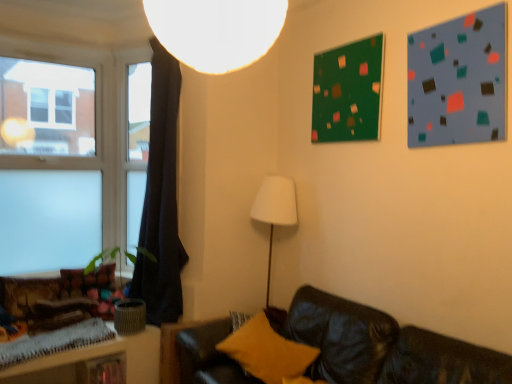
What is the approximate height of white matte lampshade at upper center?

white matte lampshade at upper center is 11.65 inches tall.

What do you see at coordinates (69, 156) in the screenshot? The image size is (512, 384). I see `transparent glass window at left` at bounding box center [69, 156].

Locate an element on the screen. transparent glass window at left is located at coordinates (x=69, y=156).

Where is `yellow fuzzy pillow at lower center, the second pillow from the left`? This screenshot has height=384, width=512. yellow fuzzy pillow at lower center, the second pillow from the left is located at coordinates (268, 352).

This screenshot has width=512, height=384. I want to click on green matte bulletin board at upper center, which is the second bulletin board from front to back, so click(x=347, y=92).

What do you see at coordinates (87, 279) in the screenshot? I see `velvet textured pillow at lower left, positioned as the second pillow in right-to-left order` at bounding box center [87, 279].

You are a GUI agent. You are given a task and a screenshot of the screen. Output one action in this format:
    pyautogui.click(x=<x>, y=<y>)
    Task: Click on the dark fabric curtain at left
    The height and width of the screenshot is (384, 512).
    Given the screenshot: What is the action you would take?
    pyautogui.click(x=161, y=199)

In the image, is dark fabric curtain at left positioned in front of or behind wooden textured table at lower left?

dark fabric curtain at left is behind wooden textured table at lower left.

Consider the image. What's the angular difference between dark fabric curtain at left and wooden textured table at lower left's facing directions?

The angle between the facing direction of dark fabric curtain at left and the facing direction of wooden textured table at lower left is 64.6 degrees.

Is dark fabric curtain at left positioned beyond the bounds of wooden textured table at lower left?

dark fabric curtain at left is positioned outside wooden textured table at lower left.

Is point (145, 277) less distant than point (65, 382)?

No, (145, 277) is further to viewer.

Looking at their sizes, would you say yellow fuzzy pillow at lower center, positioned as the second pillow in back-to-front order, is wider or thinner than dark fabric curtain at left?

Clearly, yellow fuzzy pillow at lower center, positioned as the second pillow in back-to-front order, has more width compared to dark fabric curtain at left.

Between point (264, 353) and point (176, 293), which one is positioned in front?

Positioned in front is point (264, 353).

Is yellow fuzzy pillow at lower center, marked as the 1th pillow in a right-to-left arrangement, oriented away from dark fabric curtain at left?

yellow fuzzy pillow at lower center, marked as the 1th pillow in a right-to-left arrangement, does not have its back to dark fabric curtain at left.

This screenshot has height=384, width=512. Identify the location of curtain that appears on the left of green matte bulletin board at upper center, which is the second bulletin board from front to back. (161, 199).

From a real-world perspective, does dark fabric curtain at left sit lower than green matte bulletin board at upper center, acting as the 1th bulletin board starting from the left?

Indeed, from a real-world perspective, dark fabric curtain at left is positioned beneath green matte bulletin board at upper center, acting as the 1th bulletin board starting from the left.

Based on the photo, is dark fabric curtain at left spatially inside green matte bulletin board at upper center, the 2th bulletin board when ordered from right to left, or outside of it?

dark fabric curtain at left is not inside green matte bulletin board at upper center, the 2th bulletin board when ordered from right to left, it's outside.

From the image's perspective, which is below, dark fabric curtain at left or green matte bulletin board at upper center, the 2th bulletin board when ordered from right to left?

dark fabric curtain at left appears lower in the image.

From the image's perspective, is green matte bulletin board at upper center, the 2th bulletin board when ordered from right to left, on dark fabric curtain at left?

Yes, from the image's perspective, green matte bulletin board at upper center, the 2th bulletin board when ordered from right to left, is over dark fabric curtain at left.

Which of these two, green matte bulletin board at upper center, acting as the 1th bulletin board starting from the left, or dark fabric curtain at left, is bigger?

Result: With larger size is dark fabric curtain at left.

Is green matte bulletin board at upper center, which appears as the 1th bulletin board when viewed from the back, facing towards dark fabric curtain at left?

A: No, green matte bulletin board at upper center, which appears as the 1th bulletin board when viewed from the back, is not turned towards dark fabric curtain at left.

Would you say green matte bulletin board at upper center, the 2th bulletin board when ordered from right to left, is outside dark fabric curtain at left?

Yes, green matte bulletin board at upper center, the 2th bulletin board when ordered from right to left, is not within dark fabric curtain at left.

Choose the correct answer: Is green matte bulletin board at upper center, which appears as the 1th bulletin board when viewed from the back, inside velvet textured pillow at lower left, the 2th pillow viewed from the front, or outside it?

green matte bulletin board at upper center, which appears as the 1th bulletin board when viewed from the back, lies outside velvet textured pillow at lower left, the 2th pillow viewed from the front.

Can you confirm if green matte bulletin board at upper center, which is the second bulletin board from front to back, is shorter than velvet textured pillow at lower left, positioned as the second pillow in right-to-left order?

No.

Is green matte bulletin board at upper center, the 2th bulletin board when ordered from right to left, touching velvet textured pillow at lower left, acting as the first pillow starting from the left?

They are not placed beside each other.

Considering the relative sizes of dark fabric curtain at left and velvet textured pillow at lower left, positioned as the second pillow in right-to-left order, in the image provided, is dark fabric curtain at left smaller than velvet textured pillow at lower left, positioned as the second pillow in right-to-left order,?

No.

Is velvet textured pillow at lower left, the 2th pillow viewed from the front, completely or partially inside dark fabric curtain at left?

No.

Between dark fabric curtain at left and velvet textured pillow at lower left, positioned as the second pillow in right-to-left order, which one is positioned in front?

Positioned in front is dark fabric curtain at left.

Which of these two, dark fabric curtain at left or velvet textured pillow at lower left, which is the 1th pillow in back-to-front order, stands taller?

With more height is dark fabric curtain at left.

Based on the photo, would you say transparent glass window at left is part of white matte lampshade at upper center's contents?

No, white matte lampshade at upper center does not contain transparent glass window at left.

Considering the relative sizes of white matte lampshade at upper center and transparent glass window at left in the image provided, is white matte lampshade at upper center bigger than transparent glass window at left?

No.

Is white matte lampshade at upper center thinner than transparent glass window at left?

In fact, white matte lampshade at upper center might be wider than transparent glass window at left.

From a real-world perspective, is white matte lampshade at upper center beneath transparent glass window at left?

No.

Where is `curtain lying on the right of wooden textured table at lower left`? This screenshot has height=384, width=512. curtain lying on the right of wooden textured table at lower left is located at coordinates (161, 199).

Identify the location of the 2nd pillow positioned below the dark fabric curtain at left (from the image's perspective). (268, 352).

Considering their positions, is matte blue bulletin board at upper right, positioned as the first bulletin board in front-to-back order, positioned further to dark fabric curtain at left than green matte bulletin board at upper center, the 2th bulletin board when ordered from right to left?

matte blue bulletin board at upper right, positioned as the first bulletin board in front-to-back order, is further to dark fabric curtain at left.

Which object lies further to the anchor point wooden textured table at lower left, white matte lampshade at upper center or transparent glass window at left?

white matte lampshade at upper center.

Looking at the image, which one is located closer to dark fabric curtain at left, yellow fuzzy pillow at lower center, positioned as the first pillow in front-to-back order, or velvet textured pillow at lower left, positioned as the second pillow in right-to-left order?

Based on the image, velvet textured pillow at lower left, positioned as the second pillow in right-to-left order, appears to be nearer to dark fabric curtain at left.

Which object lies further to the anchor point transparent glass window at left, white matte lampshade at upper center or velvet textured pillow at lower left, positioned as the second pillow in right-to-left order?

white matte lampshade at upper center is further to transparent glass window at left.

Which object lies nearer to the anchor point matte blue bulletin board at upper right, the second bulletin board in the back-to-front sequence, transparent glass window at left or green matte bulletin board at upper center, which is the second bulletin board from front to back?

green matte bulletin board at upper center, which is the second bulletin board from front to back, is positioned closer to the anchor matte blue bulletin board at upper right, the second bulletin board in the back-to-front sequence.

When comparing their distances from transparent glass window at left, does dark fabric curtain at left or white matte lampshade at upper center seem further?

Based on the image, white matte lampshade at upper center appears to be further to transparent glass window at left.

Consider the image. Which object lies nearer to the anchor point wooden textured table at lower left, dark fabric curtain at left or yellow fuzzy pillow at lower center, the second pillow from the left?

Among the two, dark fabric curtain at left is located nearer to wooden textured table at lower left.

Estimate the real-world distances between objects in this image. Which object is further from velvet textured pillow at lower left, acting as the first pillow starting from the left, wooden textured table at lower left or dark fabric curtain at left?

dark fabric curtain at left.

The width and height of the screenshot is (512, 384). I want to click on curtain between green matte bulletin board at upper center, which appears as the 1th bulletin board when viewed from the back, and yellow fuzzy pillow at lower center, positioned as the first pillow in front-to-back order, vertically, so pyautogui.click(x=161, y=199).

Image resolution: width=512 pixels, height=384 pixels. Find the location of `pillow located between transparent glass window at left and yellow fuzzy pillow at lower center, positioned as the second pillow in back-to-front order, in the left-right direction`. pillow located between transparent glass window at left and yellow fuzzy pillow at lower center, positioned as the second pillow in back-to-front order, in the left-right direction is located at coordinates (87, 279).

Find the location of `pillow between velvet textured pillow at lower left, positioned as the second pillow in right-to-left order, and green matte bulletin board at upper center, which is the second bulletin board from front to back, in the horizontal direction`. pillow between velvet textured pillow at lower left, positioned as the second pillow in right-to-left order, and green matte bulletin board at upper center, which is the second bulletin board from front to back, in the horizontal direction is located at coordinates (268, 352).

This screenshot has height=384, width=512. In order to click on lamp that lies between green matte bulletin board at upper center, the 2th bulletin board when ordered from right to left, and yellow fuzzy pillow at lower center, the second pillow from the left, from top to bottom in this screenshot , I will do tap(216, 31).